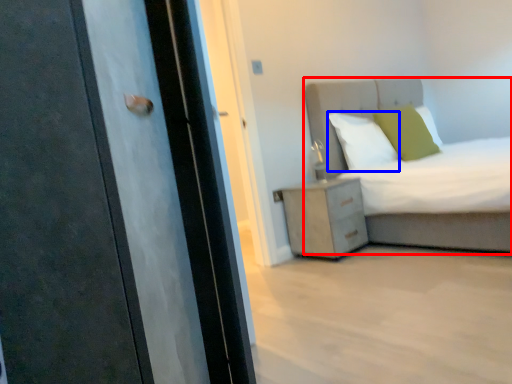
Question: Which of the following is the closest to the observer, bed (highlighted by a red box) or pillow (highlighted by a blue box)?

Choices:
 (A) bed
 (B) pillow

Answer: (A)